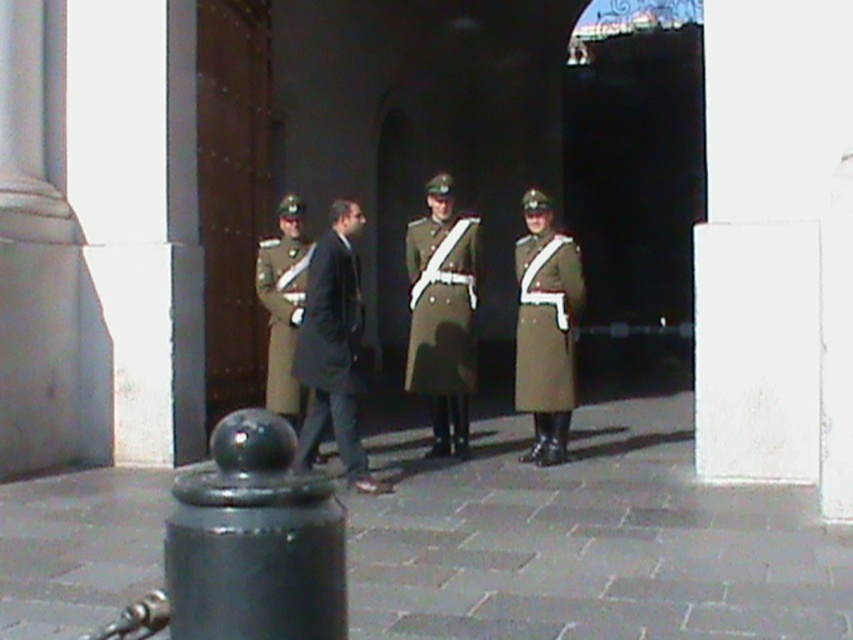
Question: Which point is closer to the camera taking this photo?

Choices:
 (A) (207, 600)
 (B) (567, 412)
 (C) (352, 321)

Answer: (A)

Question: Is matte olive-green coat at center to the left of olive green wool coat at center from the viewer's perspective?

Choices:
 (A) yes
 (B) no

Answer: (B)

Question: Where is black rubber bollard at lower left located in relation to matte olive-green coat at center in the image?

Choices:
 (A) left
 (B) right

Answer: (A)

Question: In this image, where is military green uniform at center located relative to matte olive-green coat at center?

Choices:
 (A) right
 (B) left

Answer: (B)

Question: Among these objects, which one is nearest to the camera?

Choices:
 (A) military green uniform at center
 (B) dark gray wool coat at center

Answer: (B)

Question: Which object appears farthest from the camera in this image?

Choices:
 (A) black rubber bollard at lower left
 (B) matte olive-green coat at center
 (C) dark gray wool coat at center

Answer: (B)